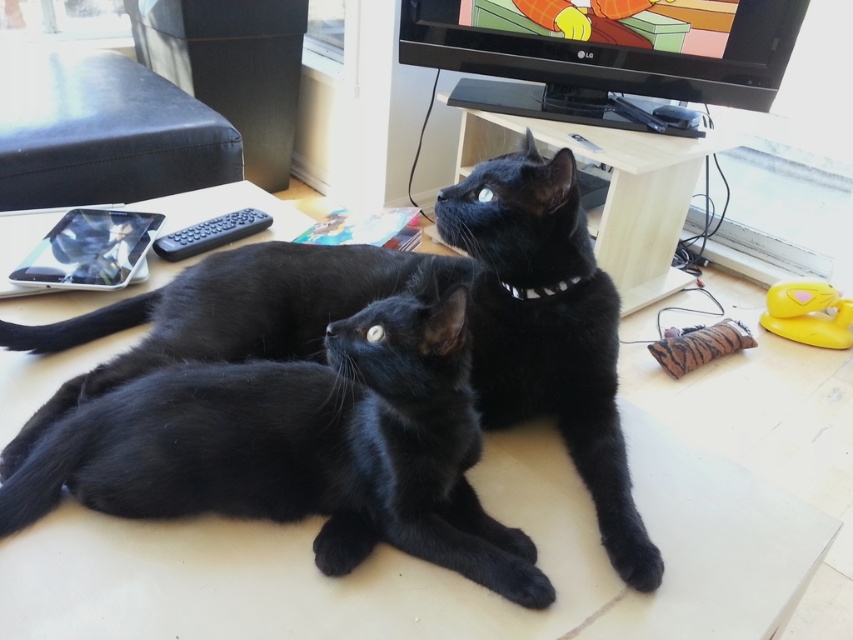
You are a photographer trying to capture a closeup of the shiny black cat at center. However, the white plastic collar at center is blocking your view. Can you estimate if the collar is smaller than the cat?

The shiny black cat at center has a larger size compared to white plastic collar at center, so yes, the collar is smaller than the cat.

You are a photographer trying to capture a closeup of the shiny black cat at center. Your camera can focus on objects within 30 inches. Will the cat be in focus?

The shiny black cat at center is 29.93 inches from camera, which is within the camera focus range of 30 inches. Yes, the cat will be in focus.